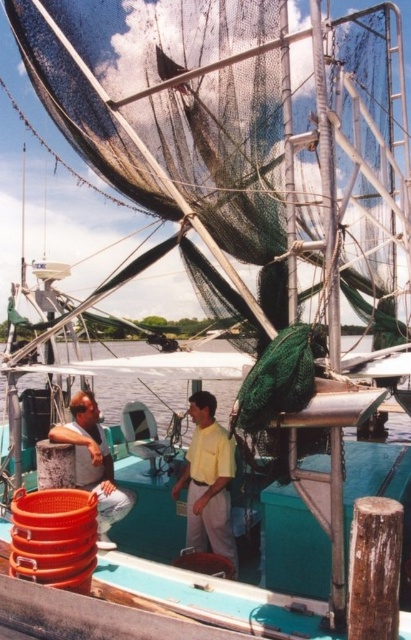
Question: Can you confirm if yellow matte shirt at center is wider than matte orange bucket at lower left?

Choices:
 (A) no
 (B) yes

Answer: (A)

Question: Which of these objects is positioned closest to the matte orange bucket at lower left?

Choices:
 (A) yellow matte shirt at center
 (B) green net at lower center

Answer: (A)

Question: Is the position of yellow matte shirt at center more distant than that of green net at lower center?

Choices:
 (A) yes
 (B) no

Answer: (A)

Question: Is the position of yellow matte shirt at center more distant than that of matte orange bucket at lower left?

Choices:
 (A) no
 (B) yes

Answer: (B)

Question: Which of the following is the closest to the observer?

Choices:
 (A) (184, 401)
 (B) (96, 426)
 (C) (230, 470)

Answer: (C)

Question: Which object is closer to the camera taking this photo?

Choices:
 (A) green net at lower center
 (B) matte orange bucket at lower left
 (C) yellow matte shirt at center

Answer: (B)